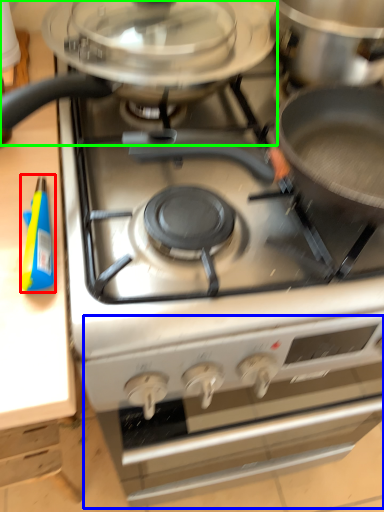
Question: Which object is positioned farthest from appliance (highlighted by a red box)? Select from oven (highlighted by a blue box) and kitchen appliance (highlighted by a green box).

Choices:
 (A) oven
 (B) kitchen appliance

Answer: (A)